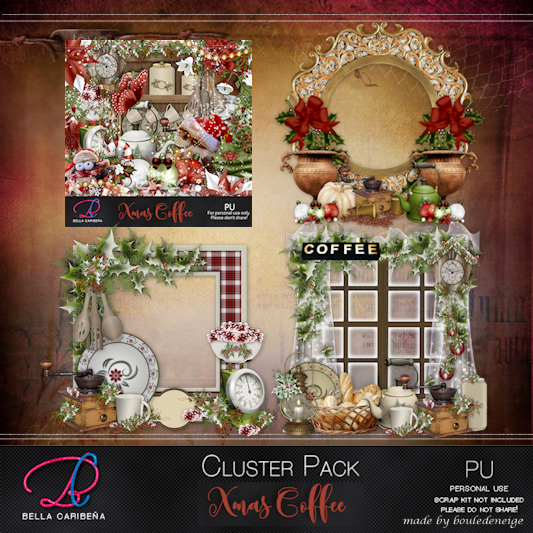
In order to click on windows in this screenshot , I will do `click(355, 314)`, `click(403, 308)`.